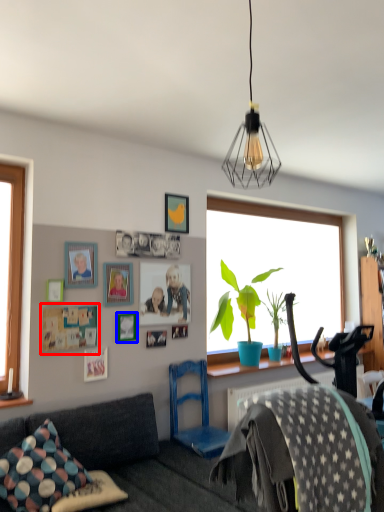
Question: Which object appears farthest to the camera in this image, picture frame (highlighted by a red box) or picture frame (highlighted by a blue box)?

Choices:
 (A) picture frame
 (B) picture frame

Answer: (B)